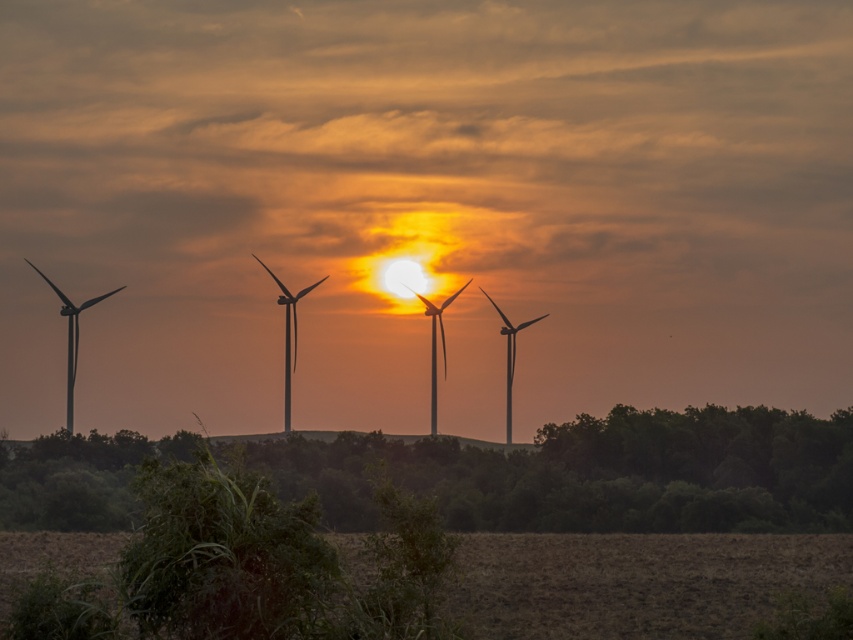
Question: In this image, where is metallic wind turbines at center located relative to metallic gray wind turbine at center?

Choices:
 (A) left
 (B) right

Answer: (A)

Question: Which object is farther from the camera taking this photo?

Choices:
 (A) matte black windmill at left
 (B) metallic wind turbines at center
 (C) metallic gray wind turbine at center
 (D) metallic gray windmill at center

Answer: (C)

Question: Among these objects, which one is farthest from the camera?

Choices:
 (A) silvery metallic wind turbine at center
 (B) metallic gray wind turbine at center

Answer: (B)

Question: Does metallic gray windmill at center have a greater width compared to silvery metallic wind turbine at center?

Choices:
 (A) yes
 (B) no

Answer: (A)

Question: Does silvery metallic wind turbine at center appear on the right side of metallic gray wind turbine at center?

Choices:
 (A) yes
 (B) no

Answer: (B)

Question: Which object is closer to the camera taking this photo?

Choices:
 (A) metallic gray wind turbine at center
 (B) matte black windmill at left
 (C) metallic wind turbines at center
 (D) metallic gray windmill at center

Answer: (B)